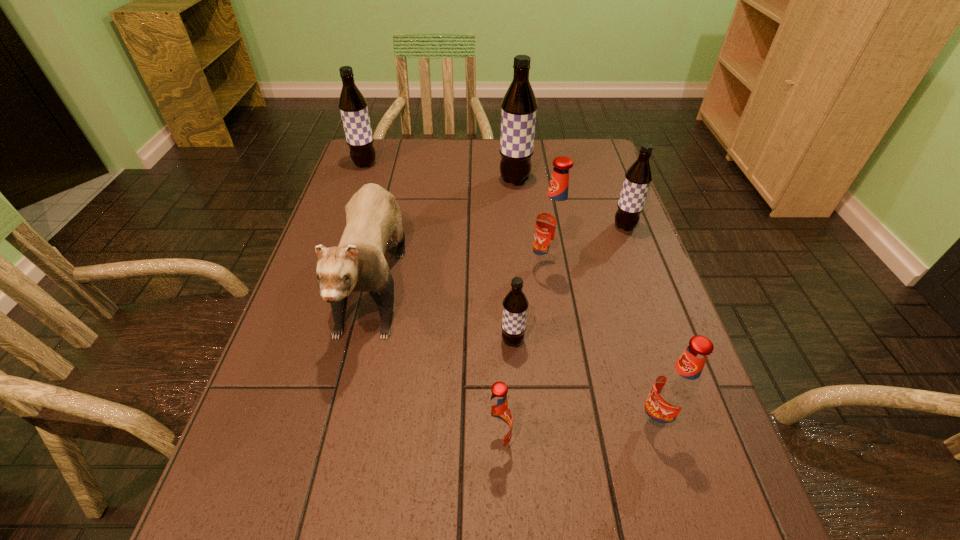
In order to click on vacant space at the near right corner of the desktop in this screenshot , I will do `click(687, 532)`.

Where is `free space between the second biggest red root beer and the smallest brown root beer`? free space between the second biggest red root beer and the smallest brown root beer is located at coordinates (585, 382).

Find the location of `blank region between the leftmost red root beer and the second red root beer from right to left`. blank region between the leftmost red root beer and the second red root beer from right to left is located at coordinates (522, 356).

Where is `empty location between the biggest red root beer and the seventh object from right to left`? empty location between the biggest red root beer and the seventh object from right to left is located at coordinates (462, 269).

You are a GUI agent. You are given a task and a screenshot of the screen. Output one action in this format:
    pyautogui.click(x=<x>, y=<y>)
    Task: Click on the free point between the farthest red root beer and the seventh object from right to left
    The image size is (960, 540).
    Given the screenshot: What is the action you would take?
    pyautogui.click(x=462, y=269)

What are the coordinates of `unoccupied area between the second smallest red root beer and the third nearest root beer` in the screenshot? It's located at [585, 382].

At what (x,y) coordinates should I click in order to perform the action: click on free area in between the second farthest root beer and the farthest root beer. Please return your answer as a coordinate pair (x, y). This screenshot has height=540, width=960. Looking at the image, I should click on (440, 172).

The image size is (960, 540). In order to click on free space between the rightmost object and the second object from right to left in this screenshot , I will do `click(640, 325)`.

At what (x,y) coordinates should I click in order to perform the action: click on the sixth closest object relative to the ferret. Please return your answer as a coordinate pair (x, y). This screenshot has width=960, height=540. Looking at the image, I should click on (675, 391).

The image size is (960, 540). What are the coordinates of `object that can be found as the second closest to the smallest brown root beer` in the screenshot? It's located at point(498,418).